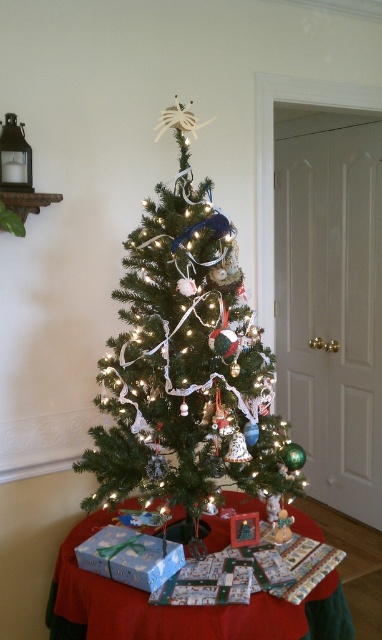
Between green matte christmas tree at center and blue paper gift at lower left, which one appears on the left side from the viewer's perspective?

blue paper gift at lower left is more to the left.

Who is taller, green matte christmas tree at center or blue paper gift at lower left?

Standing taller between the two is green matte christmas tree at center.

Who is more forward, (147, 492) or (82, 548)?

Point (147, 492) is more forward.

Find the location of a particular element. The width and height of the screenshot is (382, 640). green matte christmas tree at center is located at coordinates (187, 362).

Is green matte christmas tree at center positioned at the back of wrapping paper at lower center?

Yes.

Between point (192, 250) and point (98, 618), which one is positioned in front?

Point (98, 618) is more forward.

Where is `green matte christmas tree at center`? green matte christmas tree at center is located at coordinates (187, 362).

Consider the image. Is wrapping paper at lower center above blue paper gift at lower left?

No.

Does wrapping paper at lower center have a greater height compared to blue paper gift at lower left?

Correct, wrapping paper at lower center is much taller as blue paper gift at lower left.

Between point (56, 563) and point (158, 560), which one is positioned behind?

The point (56, 563) is more distant.

Where is `wrapping paper at lower center`? This screenshot has height=640, width=382. wrapping paper at lower center is located at coordinates tap(179, 608).